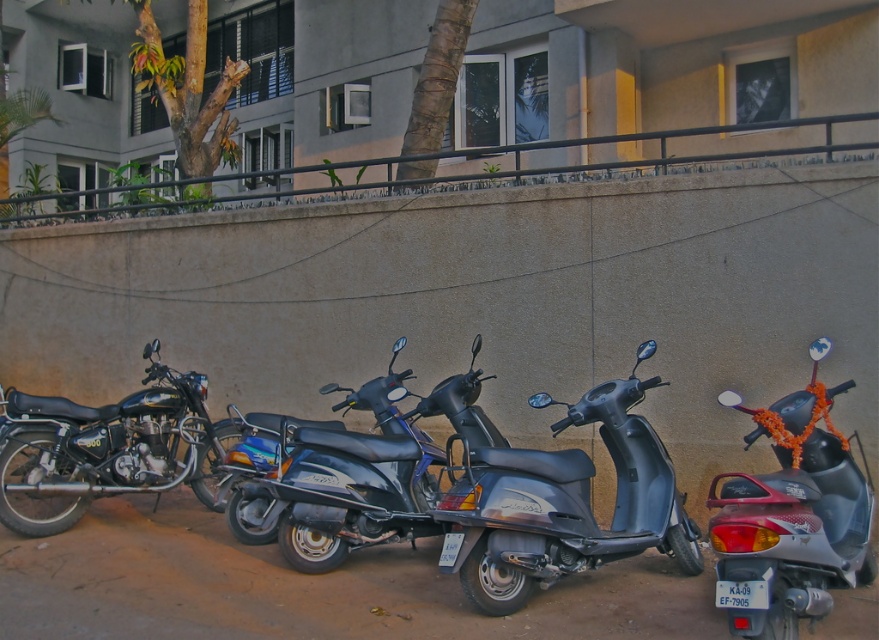
Who is taller, metallic gray scooter at center or silver metallic scooter at right?

metallic gray scooter at center

Is metallic gray scooter at center to the left of silver metallic scooter at right from the viewer's perspective?

Yes, metallic gray scooter at center is to the left of silver metallic scooter at right.

Locate an element on the screen. This screenshot has height=640, width=879. metallic gray scooter at center is located at coordinates (563, 502).

Is point (754, 525) behind point (2, 452)?

No, it is not.

Can you confirm if silver metallic scooter at right is bigger than shiny black motorcycle at left?

Incorrect, silver metallic scooter at right is not larger than shiny black motorcycle at left.

Does point (808, 522) come closer to viewer compared to point (30, 419)?

Yes, point (808, 522) is closer to viewer.

Where is `silver metallic scooter at right`? silver metallic scooter at right is located at coordinates point(790,516).

What are the coordinates of `metallic gray scooter at center` in the screenshot? It's located at coord(563,502).

Is metallic gray scooter at center shorter than shiny black motorcycle at left?

In fact, metallic gray scooter at center may be taller than shiny black motorcycle at left.

From the picture: Who is more forward, (673, 493) or (142, 436)?

Point (673, 493) is more forward.

At what (x,y) coordinates should I click in order to perform the action: click on metallic gray scooter at center. Please return your answer as a coordinate pair (x, y). The image size is (879, 640). Looking at the image, I should click on (563, 502).